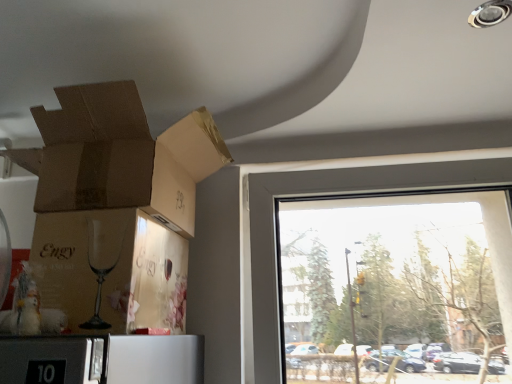
The height and width of the screenshot is (384, 512). Describe the element at coordinates (111, 269) in the screenshot. I see `matte brown cardboard at lower left, acting as the 2th cardboard box starting from the top` at that location.

Describe the element at coordinates (120, 156) in the screenshot. I see `brown cardboard box at upper left, marked as the first cardboard box in a top-to-bottom arrangement` at that location.

The image size is (512, 384). Find the location of `matte brown cardboard at lower left, acting as the 2th cardboard box starting from the top`. matte brown cardboard at lower left, acting as the 2th cardboard box starting from the top is located at coordinates (111, 269).

Considering the relative positions of matte brown cardboard at lower left, acting as the 1th cardboard box starting from the bottom, and transparent glass window at right in the image provided, is matte brown cardboard at lower left, acting as the 1th cardboard box starting from the bottom, to the right of transparent glass window at right from the viewer's perspective?

No, matte brown cardboard at lower left, acting as the 1th cardboard box starting from the bottom, is not to the right of transparent glass window at right.

In the scene shown: From a real-world perspective, is matte brown cardboard at lower left, acting as the 1th cardboard box starting from the bottom, physically below transparent glass window at right?

Yes, from a real-world perspective, matte brown cardboard at lower left, acting as the 1th cardboard box starting from the bottom, is beneath transparent glass window at right.

Is matte brown cardboard at lower left, acting as the 1th cardboard box starting from the bottom, positioned with its back to transparent glass window at right?

That's not correct — matte brown cardboard at lower left, acting as the 1th cardboard box starting from the bottom, is not looking away from transparent glass window at right.

From the image's perspective, does matte brown cardboard at lower left, acting as the 1th cardboard box starting from the bottom, appear higher than transparent glass window at right?

Yes, from the image's perspective, matte brown cardboard at lower left, acting as the 1th cardboard box starting from the bottom, is over transparent glass window at right.

From the image's perspective, is transparent glass window at right located beneath matte brown cardboard at lower left, acting as the 1th cardboard box starting from the bottom?

→ Correct, transparent glass window at right appears lower than matte brown cardboard at lower left, acting as the 1th cardboard box starting from the bottom, in the image.

Is transparent glass window at right closer to the viewer compared to matte brown cardboard at lower left, acting as the 2th cardboard box starting from the top?

No, transparent glass window at right is further to the viewer.

Which of these two, transparent glass window at right or matte brown cardboard at lower left, acting as the 2th cardboard box starting from the top, is wider?

matte brown cardboard at lower left, acting as the 2th cardboard box starting from the top, is wider.

At what (x,y) coordinates should I click in order to perform the action: click on window below the matte brown cardboard at lower left, acting as the 2th cardboard box starting from the top (from the image's perspective). Please return your answer as a coordinate pair (x, y). Looking at the image, I should click on (322, 195).

Between brown cardboard box at upper left, marked as the first cardboard box in a top-to-bottom arrangement, and matte brown cardboard at lower left, acting as the 2th cardboard box starting from the top, which one has smaller size?

Smaller between the two is matte brown cardboard at lower left, acting as the 2th cardboard box starting from the top.

Is brown cardboard box at upper left, which is the second cardboard box from bottom to top, thinner than matte brown cardboard at lower left, acting as the 2th cardboard box starting from the top?

Incorrect, the width of brown cardboard box at upper left, which is the second cardboard box from bottom to top, is not less than that of matte brown cardboard at lower left, acting as the 2th cardboard box starting from the top.

Which object is further away from the camera taking this photo, brown cardboard box at upper left, which is the second cardboard box from bottom to top, or matte brown cardboard at lower left, acting as the 1th cardboard box starting from the bottom?

brown cardboard box at upper left, which is the second cardboard box from bottom to top, is further from the camera.

Can you confirm if brown cardboard box at upper left, marked as the first cardboard box in a top-to-bottom arrangement, is shorter than transparent glass window at right?

Indeed, brown cardboard box at upper left, marked as the first cardboard box in a top-to-bottom arrangement, has a lesser height compared to transparent glass window at right.

At what (x,y) coordinates should I click in order to perform the action: click on window on the right side of brown cardboard box at upper left, marked as the first cardboard box in a top-to-bottom arrangement. Please return your answer as a coordinate pair (x, y). The width and height of the screenshot is (512, 384). Looking at the image, I should click on (322, 195).

Between brown cardboard box at upper left, which is the second cardboard box from bottom to top, and transparent glass window at right, which one is positioned in front?

Positioned in front is brown cardboard box at upper left, which is the second cardboard box from bottom to top.

From a real-world perspective, who is located higher, brown cardboard box at upper left, which is the second cardboard box from bottom to top, or transparent glass window at right?

brown cardboard box at upper left, which is the second cardboard box from bottom to top.

Would you say transparent glass window at right is a long distance from brown cardboard box at upper left, marked as the first cardboard box in a top-to-bottom arrangement?

Actually, transparent glass window at right and brown cardboard box at upper left, marked as the first cardboard box in a top-to-bottom arrangement, are a little close together.

Between transparent glass window at right and brown cardboard box at upper left, marked as the first cardboard box in a top-to-bottom arrangement, which one has larger width?

With larger width is brown cardboard box at upper left, marked as the first cardboard box in a top-to-bottom arrangement.

Is transparent glass window at right bigger or smaller than brown cardboard box at upper left, marked as the first cardboard box in a top-to-bottom arrangement?

In the image, transparent glass window at right appears to be larger than brown cardboard box at upper left, marked as the first cardboard box in a top-to-bottom arrangement.

Is transparent glass window at right looking in the opposite direction of brown cardboard box at upper left, marked as the first cardboard box in a top-to-bottom arrangement?

No, transparent glass window at right's orientation is not away from brown cardboard box at upper left, marked as the first cardboard box in a top-to-bottom arrangement.

Considering the positions of objects matte brown cardboard at lower left, acting as the 1th cardboard box starting from the bottom, and brown cardboard box at upper left, marked as the first cardboard box in a top-to-bottom arrangement, in the image provided, who is in front, matte brown cardboard at lower left, acting as the 1th cardboard box starting from the bottom, or brown cardboard box at upper left, marked as the first cardboard box in a top-to-bottom arrangement,?

Positioned in front is matte brown cardboard at lower left, acting as the 1th cardboard box starting from the bottom.

Who is bigger, matte brown cardboard at lower left, acting as the 1th cardboard box starting from the bottom, or brown cardboard box at upper left, which is the second cardboard box from bottom to top?

With larger size is brown cardboard box at upper left, which is the second cardboard box from bottom to top.

Find the location of a particular element. Image resolution: width=512 pixels, height=384 pixels. cardboard box located below the brown cardboard box at upper left, which is the second cardboard box from bottom to top (from the image's perspective) is located at coordinates (111, 269).

Can you tell me how much matte brown cardboard at lower left, acting as the 1th cardboard box starting from the bottom, and brown cardboard box at upper left, which is the second cardboard box from bottom to top, differ in facing direction?

The facing directions of matte brown cardboard at lower left, acting as the 1th cardboard box starting from the bottom, and brown cardboard box at upper left, which is the second cardboard box from bottom to top, are 0.000395 degrees apart.

Find the location of a particular element. The width and height of the screenshot is (512, 384). window above the matte brown cardboard at lower left, acting as the 1th cardboard box starting from the bottom (from a real-world perspective) is located at coordinates (322, 195).

Locate an element on the screen. This screenshot has height=384, width=512. the 1st cardboard box positioned above the transparent glass window at right (from the image's perspective) is located at coordinates (111, 269).

From the image, which object appears to be farther from matte brown cardboard at lower left, acting as the 1th cardboard box starting from the bottom, brown cardboard box at upper left, which is the second cardboard box from bottom to top, or transparent glass window at right?

Among the two, transparent glass window at right is located further to matte brown cardboard at lower left, acting as the 1th cardboard box starting from the bottom.

Considering their positions, is matte brown cardboard at lower left, acting as the 1th cardboard box starting from the bottom, positioned closer to brown cardboard box at upper left, marked as the first cardboard box in a top-to-bottom arrangement, than transparent glass window at right?

matte brown cardboard at lower left, acting as the 1th cardboard box starting from the bottom.

Looking at the image, which one is located further to brown cardboard box at upper left, which is the second cardboard box from bottom to top, transparent glass window at right or matte brown cardboard at lower left, acting as the 1th cardboard box starting from the bottom?

transparent glass window at right is positioned further to the anchor brown cardboard box at upper left, which is the second cardboard box from bottom to top.

Which object lies nearer to the anchor point matte brown cardboard at lower left, acting as the 2th cardboard box starting from the top, transparent glass window at right or brown cardboard box at upper left, marked as the first cardboard box in a top-to-bottom arrangement?

brown cardboard box at upper left, marked as the first cardboard box in a top-to-bottom arrangement.

From the picture: Which object lies nearer to the anchor point transparent glass window at right, matte brown cardboard at lower left, acting as the 1th cardboard box starting from the bottom, or brown cardboard box at upper left, marked as the first cardboard box in a top-to-bottom arrangement?

brown cardboard box at upper left, marked as the first cardboard box in a top-to-bottom arrangement.

When comparing their distances from transparent glass window at right, does brown cardboard box at upper left, which is the second cardboard box from bottom to top, or matte brown cardboard at lower left, acting as the 1th cardboard box starting from the bottom, seem further?

Among the two, matte brown cardboard at lower left, acting as the 1th cardboard box starting from the bottom, is located further to transparent glass window at right.

Where is `cardboard box between matte brown cardboard at lower left, acting as the 1th cardboard box starting from the bottom, and transparent glass window at right from left to right`? cardboard box between matte brown cardboard at lower left, acting as the 1th cardboard box starting from the bottom, and transparent glass window at right from left to right is located at coordinates (120, 156).